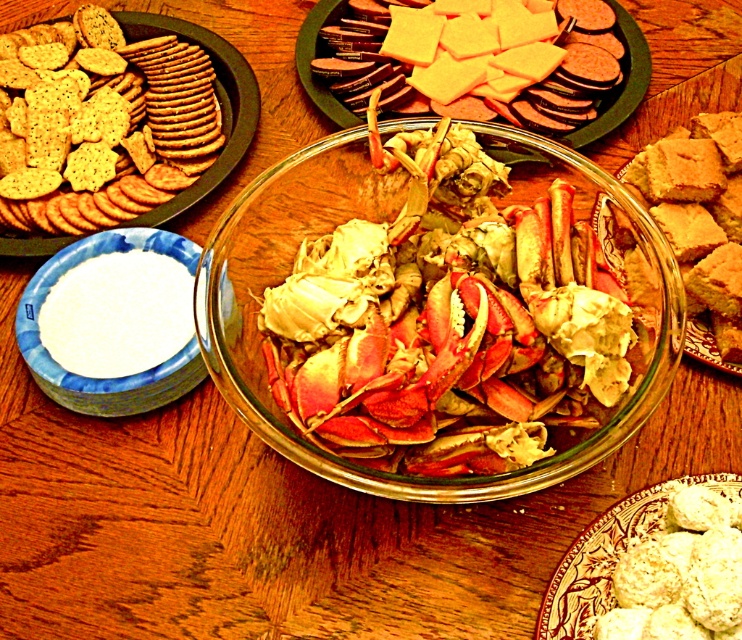
Based on the photo, which is more to the left, white paper bowl at lower left or matte brown crackers at left?

Positioned to the left is white paper bowl at lower left.

Where is `white paper bowl at lower left`? This screenshot has width=742, height=640. white paper bowl at lower left is located at coordinates (105, 378).

Is white paper bowl at lower left wider than white crumbly at lower right?

Incorrect, white paper bowl at lower left's width does not surpass white crumbly at lower right's.

Is white paper bowl at lower left behind white crumbly at lower right?

Yes.

Does point (85, 401) come in front of point (554, 577)?

No, (85, 401) is further to viewer.

This screenshot has height=640, width=742. I want to click on white paper bowl at lower left, so click(105, 378).

Does golden brown crumbly square at right appear on the right side of white crumbly at lower right?

Correct, you'll find golden brown crumbly square at right to the right of white crumbly at lower right.

Can you confirm if golden brown crumbly square at right is bigger than white crumbly at lower right?

Yes.

Is point (689, 259) farther from camera compared to point (542, 605)?

That is True.

Locate an element on the screen. Image resolution: width=742 pixels, height=640 pixels. golden brown crumbly square at right is located at coordinates (700, 225).